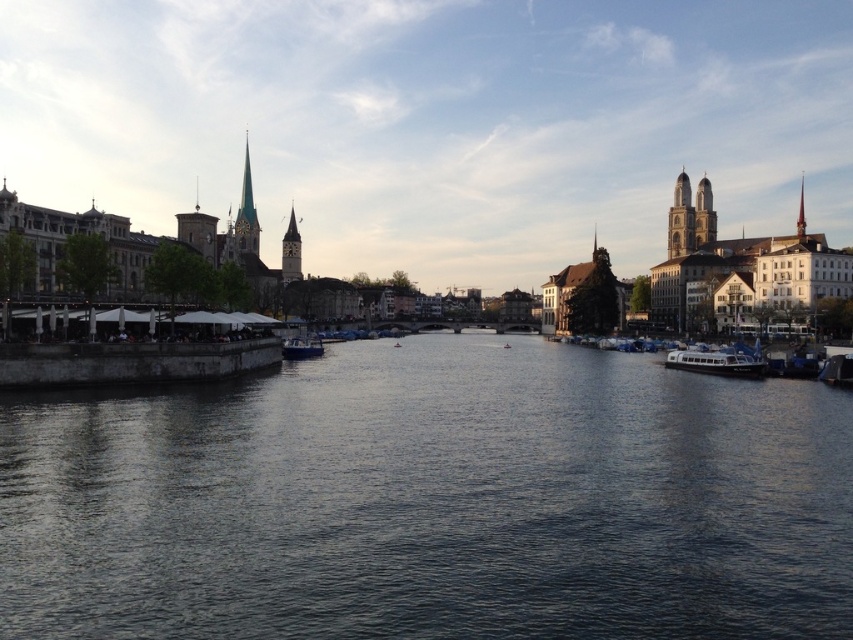
You are an architect designing a new bridge that needs to span the river. The bridge must accommodate the white glossy boat at right and the smooth stone tower at upper right. Given their sizes, which structure requires more consideration in terms of clearance and space?

The smooth stone tower at upper right requires more consideration in terms of clearance and space because it is larger than the white glossy boat at right.

You are a tour guide leading a group along the riverside. You want to mention the relative sizes of the white glossy boat at right and the smooth stone tower at upper right. How would you describe their sizes to your group?

The white glossy boat at right is wider than the smooth stone tower at upper right, so it occupies more horizontal space along the river.